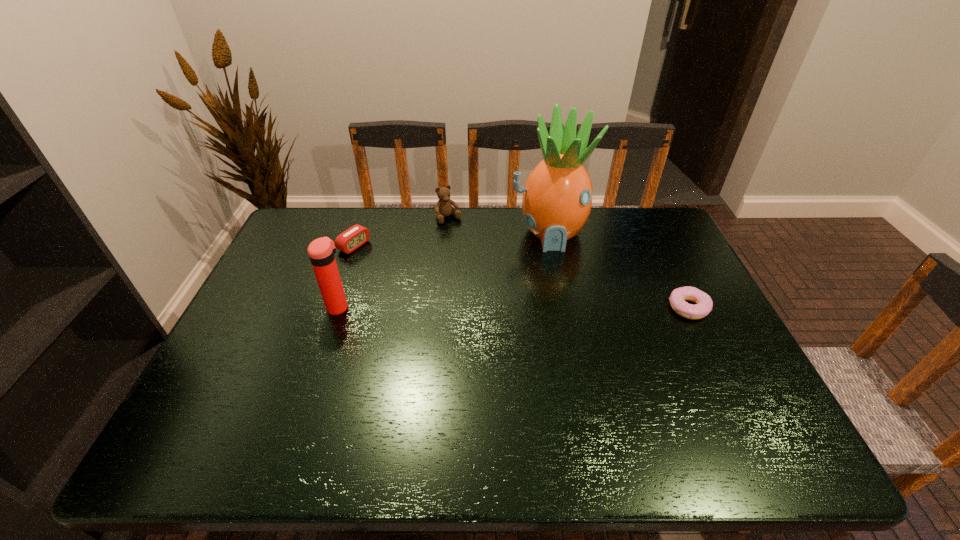
Where is `thermos bottle`? Image resolution: width=960 pixels, height=540 pixels. thermos bottle is located at coordinates (321, 251).

At what (x,y) coordinates should I click in order to perform the action: click on the shortest object. Please return your answer as a coordinate pair (x, y). Looking at the image, I should click on (704, 304).

Where is `doughnut`? Image resolution: width=960 pixels, height=540 pixels. doughnut is located at coordinates (704, 304).

Where is `the tallest object`? the tallest object is located at coordinates (557, 198).

Image resolution: width=960 pixels, height=540 pixels. I want to click on the fourth object from left to right, so click(557, 198).

Locate an element on the screen. the third shortest object is located at coordinates (443, 208).

The height and width of the screenshot is (540, 960). I want to click on teddy bear, so click(x=443, y=208).

At what (x,y) coordinates should I click in order to perform the action: click on the fourth tallest object. Please return your answer as a coordinate pair (x, y). Looking at the image, I should click on [x=354, y=237].

Where is `vacant area situated 0.090m on the right of the second tallest object`? This screenshot has height=540, width=960. vacant area situated 0.090m on the right of the second tallest object is located at coordinates (382, 307).

The height and width of the screenshot is (540, 960). I want to click on vacant area located on the back of the doughnut, so click(650, 228).